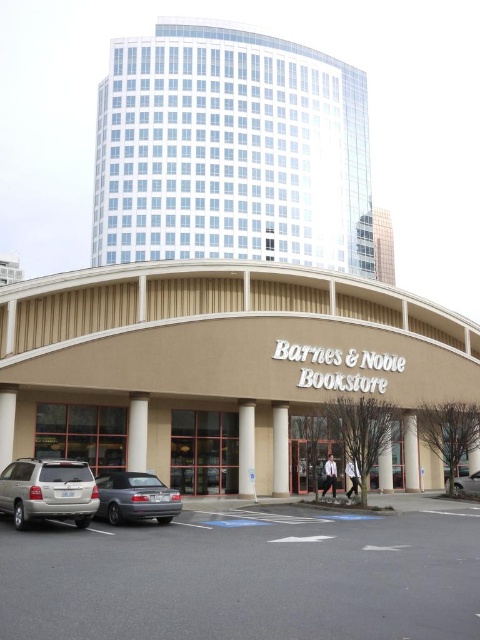
Question: Which object is closer to the camera taking this photo?

Choices:
 (A) matte gray sedan at lower left
 (B) silver metallic suv at lower left

Answer: (B)

Question: Estimate the real-world distances between objects in this image. Which object is closer to the matte gray sedan at lower left?

Choices:
 (A) silver metallic sedan at center
 (B) silver metallic suv at lower left

Answer: (B)

Question: Does silver metallic suv at lower left appear under matte gray sedan at lower left?

Choices:
 (A) yes
 (B) no

Answer: (B)

Question: Where is matte gray sedan at lower left located in relation to silver metallic sedan at center in the image?

Choices:
 (A) right
 (B) left

Answer: (B)

Question: Which of the following is the farthest from the observer?

Choices:
 (A) silver metallic suv at lower left
 (B) silver metallic sedan at center
 (C) matte gray sedan at lower left

Answer: (B)

Question: Does silver metallic suv at lower left appear under silver metallic sedan at center?

Choices:
 (A) no
 (B) yes

Answer: (A)